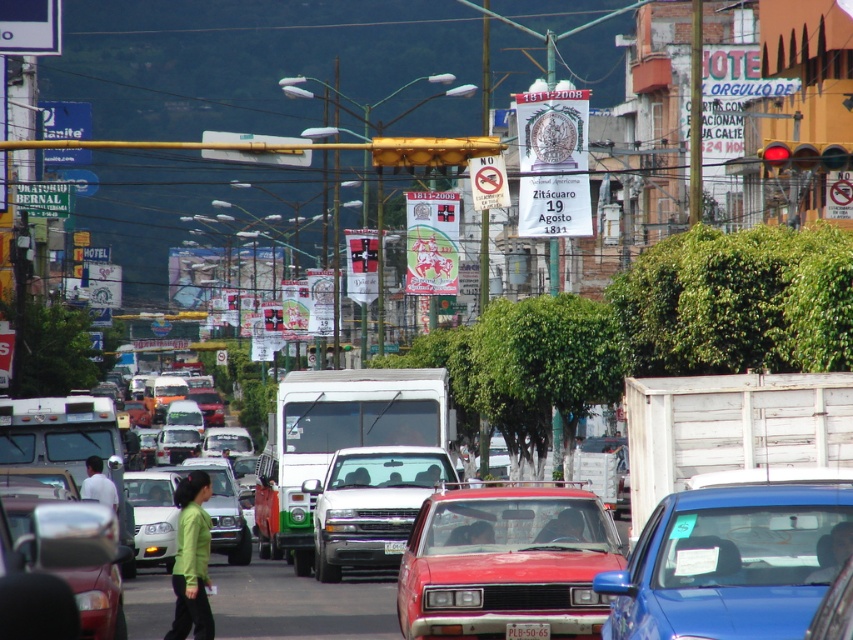
Can you confirm if shiny silver sedan at center is taller than green matte jacket at lower left?

No, shiny silver sedan at center is not taller than green matte jacket at lower left.

Between point (80, 508) and point (178, 497), which one is positioned behind?

Point (178, 497)

Which is in front, point (9, 586) or point (189, 490)?

Point (9, 586) is more forward.

Image resolution: width=853 pixels, height=640 pixels. Identify the location of shiny silver sedan at center. (54, 564).

From the picture: Can you confirm if shiny red sedan at center is smaller than green matte shirt at center?

Actually, shiny red sedan at center might be larger than green matte shirt at center.

Locate an element on the screen. shiny red sedan at center is located at coordinates (506, 563).

Where is `shiny red sedan at center`? The width and height of the screenshot is (853, 640). shiny red sedan at center is located at coordinates (506, 563).

Between point (750, 492) and point (10, 541), which one is positioned behind?

The point (10, 541) is more distant.

Who is positioned more to the left, shiny blue sedan at center or shiny silver sedan at center?

From the viewer's perspective, shiny silver sedan at center appears more on the left side.

Who is more distant from viewer, (x=730, y=506) or (x=115, y=577)?

Point (x=115, y=577)

Locate an element on the screen. This screenshot has height=640, width=853. shiny blue sedan at center is located at coordinates (730, 563).